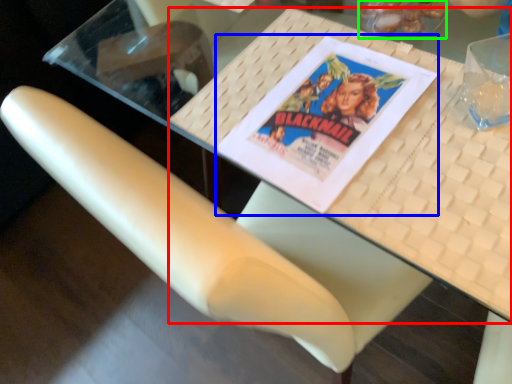
Question: Estimate the real-world distances between objects in this image. Which object is farther from table (highlighted by a red box), paperback book (highlighted by a blue box) or food (highlighted by a green box)?

Choices:
 (A) paperback book
 (B) food

Answer: (B)